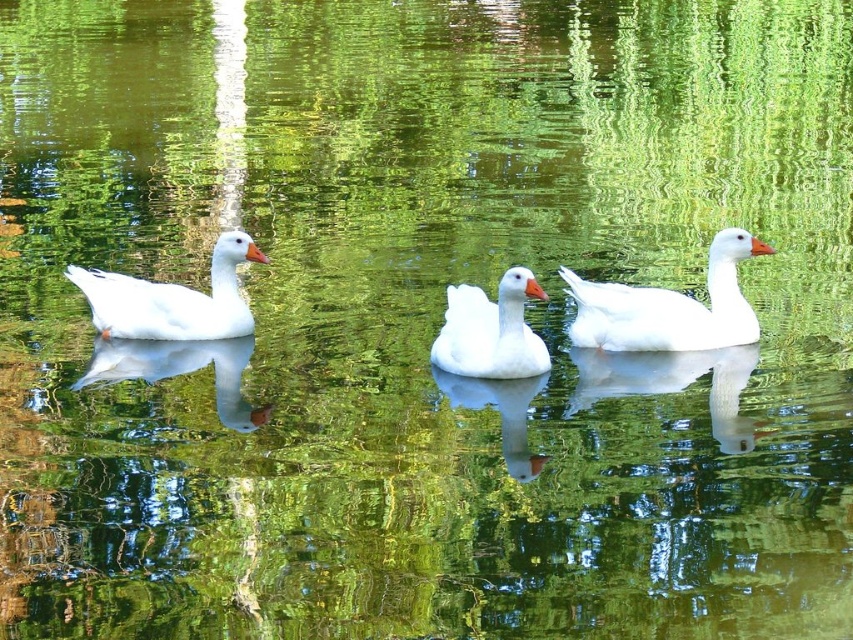
You are observing the three white geese in the water. The scene includes a white matte duck at right and a white matte duck at left. Which of these two ducks is positioned higher above the water surface?

The white matte duck at right is much taller as white matte duck at left, so the white matte duck at right is positioned higher above the water surface.

You are a photographer trying to capture the reflection of the white matte duck at right in the water. Based on the scene, where should you position your camera to ensure the reflection is fully visible in the photo?

To capture the reflection of the white matte duck at right, position the camera at the same height as the water surface and aim towards the point where the white matte duck at right is located. Since the reflection is directly below the object, aligning the camera at water level will ensure the reflection is fully visible.

From the picture: You are observing two white matte ducks in a pond. The white matte duck at right and the white matte duck at center are both visible. Which one appears taller in the scene?

The white matte duck at right has a greater height compared to the white matte duck at center, so it appears taller.